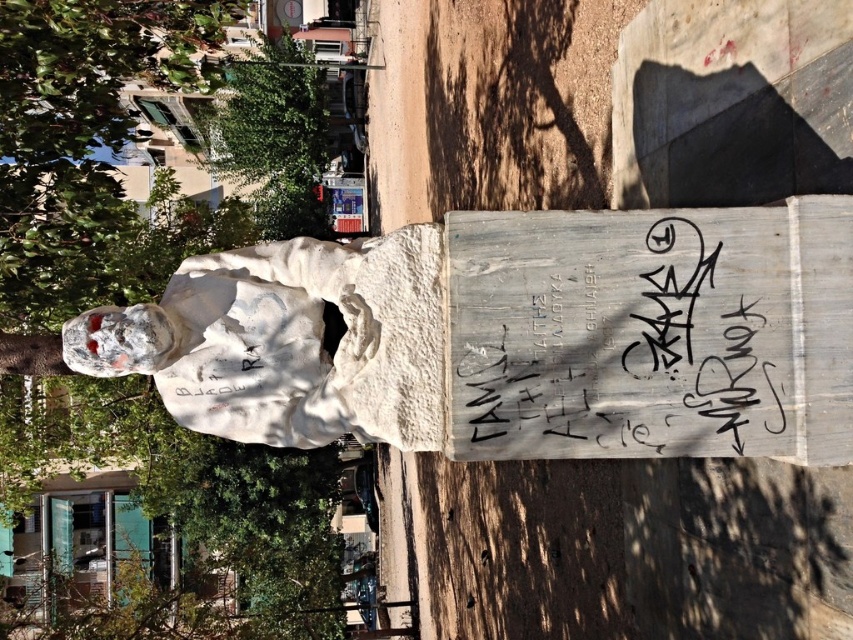
Question: Is green leafy tree at upper left thinner than black painted wood sign at center?

Choices:
 (A) yes
 (B) no

Answer: (B)

Question: Can you confirm if green leafy tree at upper left is thinner than green leafy tree at upper center?

Choices:
 (A) no
 (B) yes

Answer: (A)

Question: Which of the following is the closest to the observer?

Choices:
 (A) green leafy tree at upper center
 (B) black painted wood sign at center
 (C) green leafy tree at upper left

Answer: (B)

Question: Among these objects, which one is nearest to the camera?

Choices:
 (A) green leafy tree at upper center
 (B) black painted wood sign at center
 (C) green leafy tree at upper left

Answer: (B)

Question: Among these objects, which one is farthest from the camera?

Choices:
 (A) green leafy tree at upper left
 (B) green leafy tree at upper center
 (C) black painted wood sign at center

Answer: (B)

Question: Observing the image, what is the correct spatial positioning of black painted wood sign at center in reference to green leafy tree at upper center?

Choices:
 (A) below
 (B) above

Answer: (A)